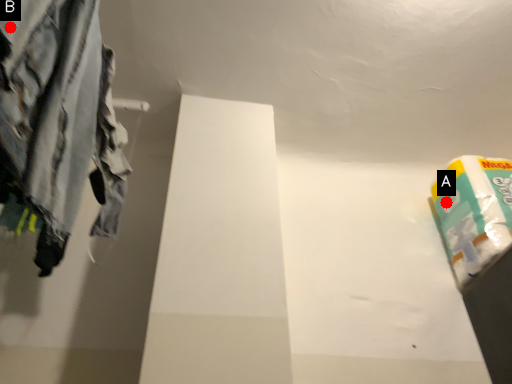
Question: Two points are circled on the image, labeled by A and B beside each circle. Which point is further to the camera?

Choices:
 (A) A is further
 (B) B is further

Answer: (A)